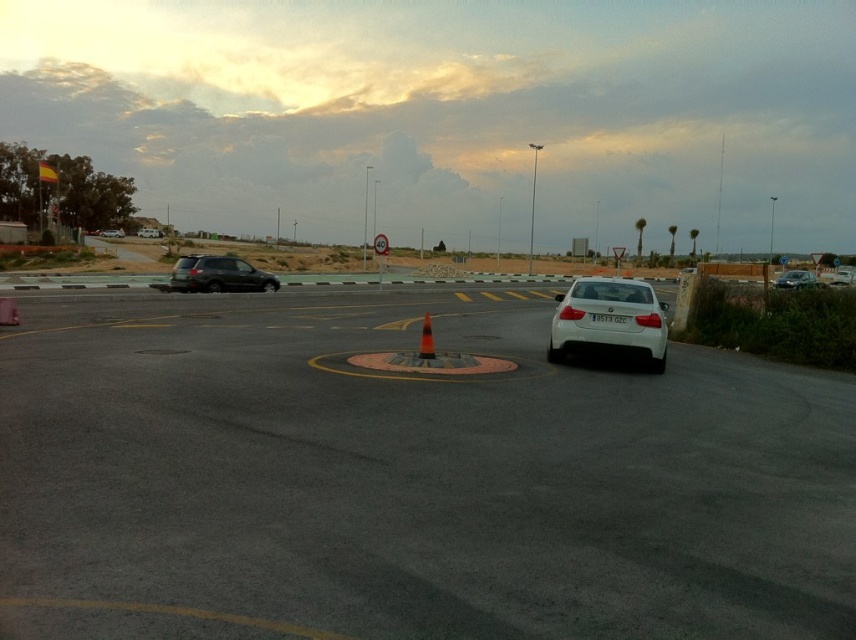
Is white glossy car at center wider than orange reflective cone at center?

Indeed, white glossy car at center has a greater width compared to orange reflective cone at center.

Is white glossy car at center to the right of orange reflective cone at center from the viewer's perspective?

Incorrect, white glossy car at center is not on the right side of orange reflective cone at center.

What do you see at coordinates (406, 480) in the screenshot? I see `white glossy car at center` at bounding box center [406, 480].

Find the location of a particular element. The width and height of the screenshot is (856, 640). white glossy car at center is located at coordinates (406, 480).

Between white glossy sedan at center and orange reflective cone at center, which one has less height?

With less height is orange reflective cone at center.

Where is `white glossy sedan at center`? The height and width of the screenshot is (640, 856). white glossy sedan at center is located at coordinates (607, 323).

How far apart are white glossy car at center and satin black suv at left?

A distance of 60.54 feet exists between white glossy car at center and satin black suv at left.

Consider the image. Does white glossy car at center lie behind satin black suv at left?

No, it is not.

This screenshot has height=640, width=856. In order to click on white glossy car at center in this screenshot , I will do `click(406, 480)`.